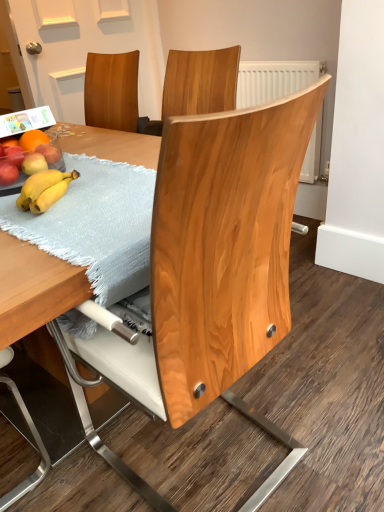
At what (x,y) coordinates should I click in order to perform the action: click on matte red apple at left, arranged as the fourth apple when viewed from the back. Please return your answer as a coordinate pair (x, y). Image resolution: width=384 pixels, height=512 pixels. Looking at the image, I should click on (8, 173).

What do you see at coordinates (8, 173) in the screenshot? I see `matte red apple at left, arranged as the fourth apple when viewed from the back` at bounding box center [8, 173].

The height and width of the screenshot is (512, 384). Describe the element at coordinates (14, 155) in the screenshot. I see `matte red apple at left, which ranks as the 2th apple in back-to-front order` at that location.

What do you see at coordinates (49, 153) in the screenshot? The width and height of the screenshot is (384, 512). I see `matte red apple at left, the fourth apple when ordered from front to back` at bounding box center [49, 153].

This screenshot has height=512, width=384. In order to click on yellow matte apple at left, arranged as the 3th apple when viewed from the back in this screenshot , I will do `click(34, 163)`.

What do you see at coordinates (216, 264) in the screenshot? I see `natural wood chair at center` at bounding box center [216, 264].

The height and width of the screenshot is (512, 384). In order to click on light blue textured placemat at table in this screenshot , I will do `click(96, 225)`.

Is light blue textured placemat at table inside or outside of natural wood chair at center?

The correct answer is: inside.

Which point is more forward, (x=99, y=234) or (x=242, y=125)?

Positioned in front is point (x=242, y=125).

Who is more distant, light blue textured placemat at table or natural wood chair at center?

Positioned behind is light blue textured placemat at table.

How many degrees apart are the facing directions of light blue textured placemat at table and natural wood chair at center?

light blue textured placemat at table and natural wood chair at center are facing 0.78 degrees away from each other.

Which object is thinner, yellow matte apple at left, arranged as the second apple when viewed from the front, or matte red apple at left, acting as the 1th apple starting from the front?

Thinner between the two is matte red apple at left, acting as the 1th apple starting from the front.

Can you tell me how much yellow matte apple at left, arranged as the second apple when viewed from the front, and matte red apple at left, arranged as the fourth apple when viewed from the back, differ in facing direction?

The angle between the facing direction of yellow matte apple at left, arranged as the second apple when viewed from the front, and the facing direction of matte red apple at left, arranged as the fourth apple when viewed from the back, is 2.61 degrees.

Visually, is yellow matte apple at left, arranged as the 3th apple when viewed from the back, positioned to the left or to the right of matte red apple at left, arranged as the fourth apple when viewed from the back?

yellow matte apple at left, arranged as the 3th apple when viewed from the back, is to the right of matte red apple at left, arranged as the fourth apple when viewed from the back.

Considering the sizes of objects natural wood chair at center and matte red apple at left, marked as the first apple in a back-to-front arrangement, in the image provided, who is wider, natural wood chair at center or matte red apple at left, marked as the first apple in a back-to-front arrangement,?

With larger width is natural wood chair at center.

From a real-world perspective, is natural wood chair at center over matte red apple at left, the fourth apple when ordered from front to back?

Actually, natural wood chair at center is physically below matte red apple at left, the fourth apple when ordered from front to back, in the real world.

Which point is more distant from viewer, (254, 173) or (51, 151)?

The point (51, 151) is more distant.

From the picture: In terms of height, does natural wood chair at center look taller or shorter compared to matte red apple at left, marked as the first apple in a back-to-front arrangement?

Clearly, natural wood chair at center is taller compared to matte red apple at left, marked as the first apple in a back-to-front arrangement.

Is matte red apple at left, arranged as the 3th apple when viewed from the front, situated inside matte red apple at left, acting as the 1th apple starting from the front, or outside?

The correct answer is: outside.

Considering the positions of objects matte red apple at left, arranged as the 3th apple when viewed from the front, and matte red apple at left, arranged as the fourth apple when viewed from the back, in the image provided, who is more to the left, matte red apple at left, arranged as the 3th apple when viewed from the front, or matte red apple at left, arranged as the fourth apple when viewed from the back,?

matte red apple at left, arranged as the fourth apple when viewed from the back, is more to the left.

Considering the sizes of matte red apple at left, arranged as the 3th apple when viewed from the front, and matte red apple at left, acting as the 1th apple starting from the front, in the image, is matte red apple at left, arranged as the 3th apple when viewed from the front, bigger or smaller than matte red apple at left, acting as the 1th apple starting from the front,?

Considering their sizes, matte red apple at left, arranged as the 3th apple when viewed from the front, takes up more space than matte red apple at left, acting as the 1th apple starting from the front.

Which of these two, matte red apple at left, arranged as the 3th apple when viewed from the front, or natural wood chair at center, stands taller?

natural wood chair at center is taller.

Measure the distance between matte red apple at left, arranged as the 3th apple when viewed from the front, and natural wood chair at center.

matte red apple at left, arranged as the 3th apple when viewed from the front, and natural wood chair at center are 25.98 inches apart.

How many degrees apart are the facing directions of matte red apple at left, which ranks as the 2th apple in back-to-front order, and natural wood chair at center?

The angular difference between matte red apple at left, which ranks as the 2th apple in back-to-front order, and natural wood chair at center is 176 degrees.

Is matte red apple at left, arranged as the 3th apple when viewed from the front, directly adjacent to natural wood chair at center?

No, matte red apple at left, arranged as the 3th apple when viewed from the front, is not with natural wood chair at center.

From a real-world perspective, between natural wood chair at center and light blue textured placemat at table, who is vertically higher?

light blue textured placemat at table.

Between natural wood chair at center and light blue textured placemat at table, which one has smaller width?

With smaller width is natural wood chair at center.

Who is taller, natural wood chair at center or light blue textured placemat at table?

With more height is natural wood chair at center.

From the image's perspective, which apple is the 2nd one below the matte red apple at left, marked as the first apple in a back-to-front arrangement? Please provide its 2D coordinates.

[(34, 163)]

From the image's perspective, is matte red apple at left, marked as the first apple in a back-to-front arrangement, located beneath yellow matte apple at left, arranged as the second apple when viewed from the front?

Actually, matte red apple at left, marked as the first apple in a back-to-front arrangement, appears above yellow matte apple at left, arranged as the second apple when viewed from the front, in the image.

From the picture: Can you tell me how much matte red apple at left, marked as the first apple in a back-to-front arrangement, and yellow matte apple at left, arranged as the 3th apple when viewed from the back, differ in facing direction?

The angle between the facing direction of matte red apple at left, marked as the first apple in a back-to-front arrangement, and the facing direction of yellow matte apple at left, arranged as the 3th apple when viewed from the back, is 0.00229 degrees.

Considering the sizes of objects matte red apple at left, the fourth apple when ordered from front to back, and yellow matte apple at left, arranged as the 3th apple when viewed from the back, in the image provided, who is shorter, matte red apple at left, the fourth apple when ordered from front to back, or yellow matte apple at left, arranged as the 3th apple when viewed from the back,?

With less height is yellow matte apple at left, arranged as the 3th apple when viewed from the back.

You are a GUI agent. You are given a task and a screenshot of the screen. Output one action in this format:
    pyautogui.click(x=<x>, y=<y>)
    Task: Click on the chair below the light blue textured placemat at table (from a real-world perspective)
    The image size is (384, 512).
    Given the screenshot: What is the action you would take?
    pyautogui.click(x=216, y=264)

From the matte red apple at left, acting as the 1th apple starting from the front, count 2nd apple to the right and point to it. Please provide its 2D coordinates.

[(34, 163)]

Based on their spatial positions, is matte red apple at left, which ranks as the 2th apple in back-to-front order, or yellow matte apple at left, arranged as the 3th apple when viewed from the back, further from natural wood chair at center?

Based on the image, matte red apple at left, which ranks as the 2th apple in back-to-front order, appears to be further to natural wood chair at center.

From the image, which object appears to be farther from matte red apple at left, arranged as the fourth apple when viewed from the back, natural wood chair at center or matte red apple at left, which ranks as the 2th apple in back-to-front order?

Among the two, natural wood chair at center is located further to matte red apple at left, arranged as the fourth apple when viewed from the back.

Estimate the real-world distances between objects in this image. Which object is closer to matte red apple at left, acting as the 1th apple starting from the front, matte red apple at left, the fourth apple when ordered from front to back, or natural wood chair at center?

Among the two, matte red apple at left, the fourth apple when ordered from front to back, is located nearer to matte red apple at left, acting as the 1th apple starting from the front.

From the image, which object appears to be farther from light blue textured placemat at table, matte red apple at left, marked as the first apple in a back-to-front arrangement, or matte red apple at left, arranged as the fourth apple when viewed from the back?

The object further to light blue textured placemat at table is matte red apple at left, marked as the first apple in a back-to-front arrangement.

Looking at the image, which one is located further to matte red apple at left, marked as the first apple in a back-to-front arrangement, light blue textured placemat at table or natural wood chair at center?

natural wood chair at center lies further to matte red apple at left, marked as the first apple in a back-to-front arrangement, than the other object.

Which object lies nearer to the anchor point natural wood chair at center, yellow matte apple at left, arranged as the 3th apple when viewed from the back, or matte red apple at left, arranged as the fourth apple when viewed from the back?

yellow matte apple at left, arranged as the 3th apple when viewed from the back, lies closer to natural wood chair at center than the other object.

From the image, which object appears to be farther from matte red apple at left, marked as the first apple in a back-to-front arrangement, natural wood chair at center or light blue textured placemat at table?

The object further to matte red apple at left, marked as the first apple in a back-to-front arrangement, is natural wood chair at center.

Based on their spatial positions, is yellow matte apple at left, arranged as the 3th apple when viewed from the back, or matte red apple at left, which ranks as the 2th apple in back-to-front order, closer to light blue textured placemat at table?

yellow matte apple at left, arranged as the 3th apple when viewed from the back.

This screenshot has width=384, height=512. Identify the location of apple located between natural wood chair at center and yellow matte apple at left, arranged as the 3th apple when viewed from the back, in the depth direction. (8, 173).

You are a GUI agent. You are given a task and a screenshot of the screen. Output one action in this format:
    pyautogui.click(x=<x>, y=<y>)
    Task: Click on the blanket between natural wood chair at center and matte red apple at left, acting as the 1th apple starting from the front, from front to back
    The image size is (384, 512).
    Given the screenshot: What is the action you would take?
    pyautogui.click(x=96, y=225)

Find the location of a particular element. The image size is (384, 512). blanket between natural wood chair at center and matte red apple at left, the fourth apple when ordered from front to back, from front to back is located at coordinates (96, 225).

This screenshot has width=384, height=512. Find the location of `apple between matte red apple at left, arranged as the fourth apple when viewed from the back, and yellow matte apple at left, arranged as the 3th apple when viewed from the back`. apple between matte red apple at left, arranged as the fourth apple when viewed from the back, and yellow matte apple at left, arranged as the 3th apple when viewed from the back is located at coordinates (14, 155).